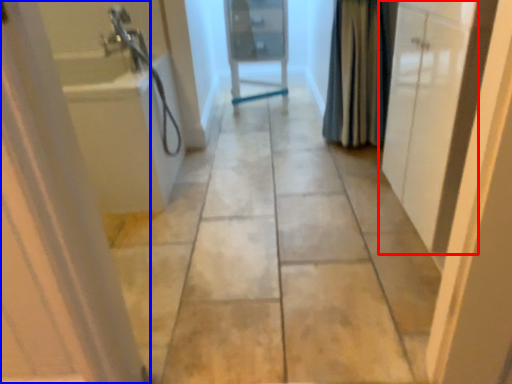
Question: Which of the following is the closest to the observer, door (highlighted by a red box) or door (highlighted by a blue box)?

Choices:
 (A) door
 (B) door

Answer: (B)